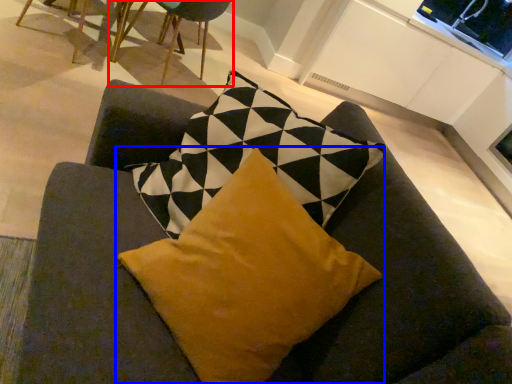
Question: Which point is closer to the camera, chair (highlighted by a red box) or pillow (highlighted by a blue box)?

Choices:
 (A) chair
 (B) pillow

Answer: (B)